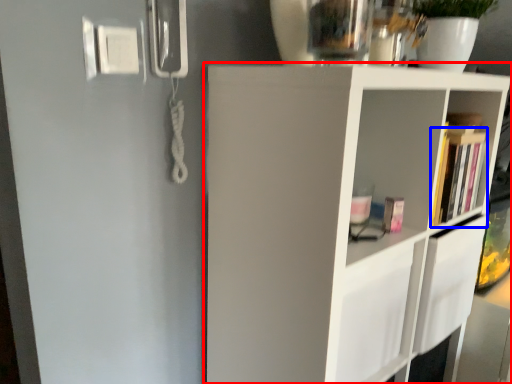
Question: Among these objects, which one is nearest to the camera, shelf (highlighted by a red box) or book (highlighted by a blue box)?

Choices:
 (A) shelf
 (B) book

Answer: (A)